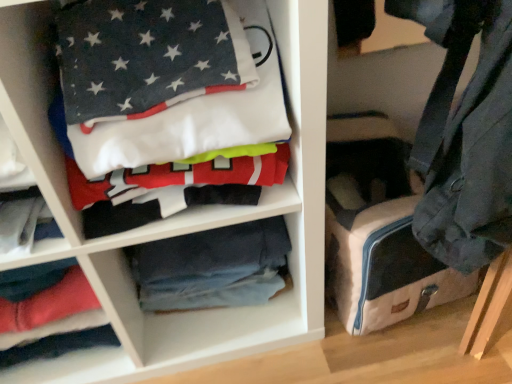
Question: Is dark blue cotton t-shirt at upper left a part of blue denim jeans at center?

Choices:
 (A) no
 (B) yes

Answer: (A)

Question: From a real-world perspective, is blue denim jeans at center over dark blue cotton t-shirt at upper left?

Choices:
 (A) no
 (B) yes

Answer: (A)

Question: Is blue denim jeans at center positioned in front of dark blue cotton t-shirt at upper left?

Choices:
 (A) yes
 (B) no

Answer: (B)

Question: Is blue denim jeans at center further to the viewer compared to dark blue cotton t-shirt at upper left?

Choices:
 (A) yes
 (B) no

Answer: (A)

Question: Can you confirm if blue denim jeans at center is positioned to the right of dark blue cotton t-shirt at upper left?

Choices:
 (A) yes
 (B) no

Answer: (A)

Question: Is blue denim jeans at center bigger or smaller than canvas suitcase at lower right?

Choices:
 (A) small
 (B) big

Answer: (A)

Question: Considering the positions of blue denim jeans at center and canvas suitcase at lower right in the image, is blue denim jeans at center taller or shorter than canvas suitcase at lower right?

Choices:
 (A) short
 (B) tall

Answer: (A)

Question: Is point (138, 284) closer or farther from the camera than point (335, 261)?

Choices:
 (A) closer
 (B) farther

Answer: (B)

Question: In terms of width, does blue denim jeans at center look wider or thinner when compared to canvas suitcase at lower right?

Choices:
 (A) thin
 (B) wide

Answer: (A)

Question: Looking at the image, does canvas suitcase at lower right seem bigger or smaller compared to dark blue cotton t-shirt at upper left?

Choices:
 (A) small
 (B) big

Answer: (A)

Question: In terms of width, does canvas suitcase at lower right look wider or thinner when compared to dark blue cotton t-shirt at upper left?

Choices:
 (A) thin
 (B) wide

Answer: (A)

Question: From a real-world perspective, is canvas suitcase at lower right positioned above or below dark blue cotton t-shirt at upper left?

Choices:
 (A) above
 (B) below

Answer: (B)

Question: Visually, is canvas suitcase at lower right positioned to the left or to the right of dark blue cotton t-shirt at upper left?

Choices:
 (A) right
 (B) left

Answer: (A)

Question: Based on their sizes in the image, would you say dark blue cotton t-shirt at upper left is bigger or smaller than canvas suitcase at lower right?

Choices:
 (A) small
 (B) big

Answer: (B)

Question: From a real-world perspective, is dark blue cotton t-shirt at upper left physically located above or below canvas suitcase at lower right?

Choices:
 (A) above
 (B) below

Answer: (A)